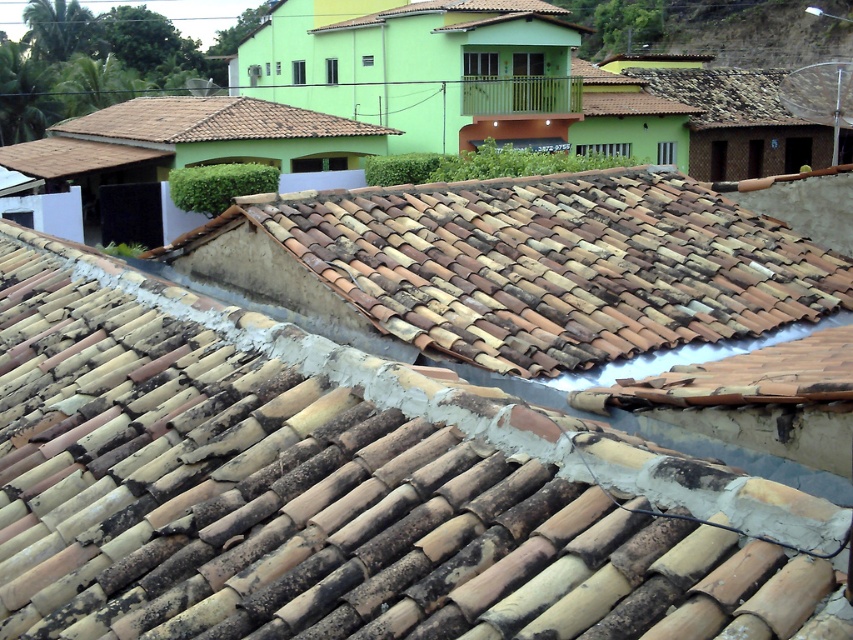
Does brown weathered tiles at center come in front of brown clay tiles at center?

That is True.

Can you confirm if brown weathered tiles at center is positioned below brown clay tiles at center?

Correct, brown weathered tiles at center is located below brown clay tiles at center.

Is point (22, 632) behind point (757, 268)?

No, it is not.

Find the location of a particular element. This screenshot has height=640, width=853. brown weathered tiles at center is located at coordinates (335, 488).

Which of these two, brown weathered tiles at center or brown tile roof at upper left, stands shorter?

brown weathered tiles at center is shorter.

Is point (115, 417) positioned before point (209, 120)?

Yes, it is in front of point (209, 120).

Does point (158, 547) come farther from viewer compared to point (149, 129)?

That is False.

Where is `brown weathered tiles at center`? brown weathered tiles at center is located at coordinates (335, 488).

Between point (438, 349) and point (209, 134), which one is positioned in front?

Point (438, 349) is more forward.

The height and width of the screenshot is (640, 853). What do you see at coordinates (519, 266) in the screenshot?
I see `brown clay tiles at center` at bounding box center [519, 266].

Is point (386, 280) positioned before point (154, 100)?

Yes, it is.

Where is `brown clay tiles at center`? The height and width of the screenshot is (640, 853). brown clay tiles at center is located at coordinates (519, 266).